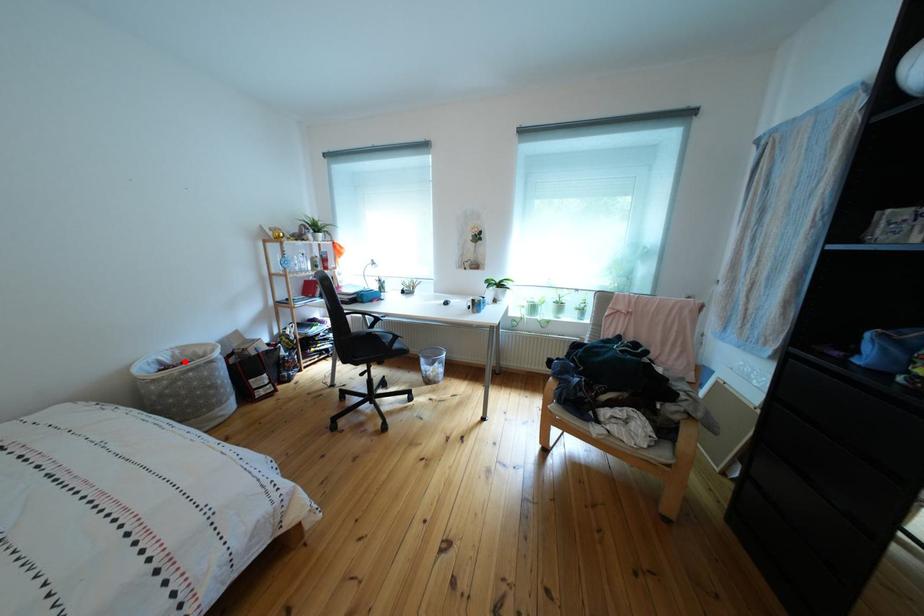
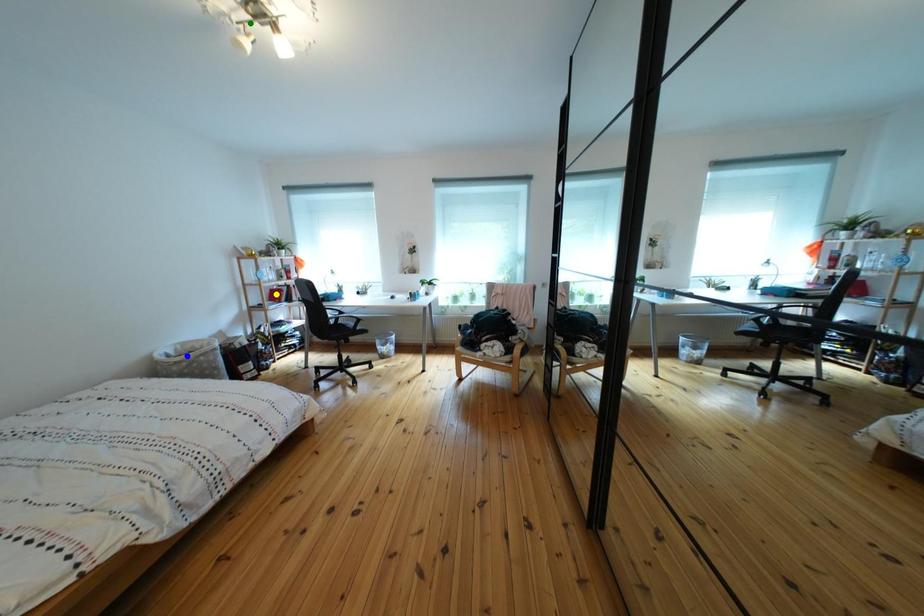
Question: I am providing you with two images of the same scene from different viewpoints. A red point is marked on the first image. You are given multiple points on the second image. Which spot in image 2 lines up with the point in image 1?

Choices:
 (A) blue point
 (B) green point
 (C) yellow point

Answer: (A)